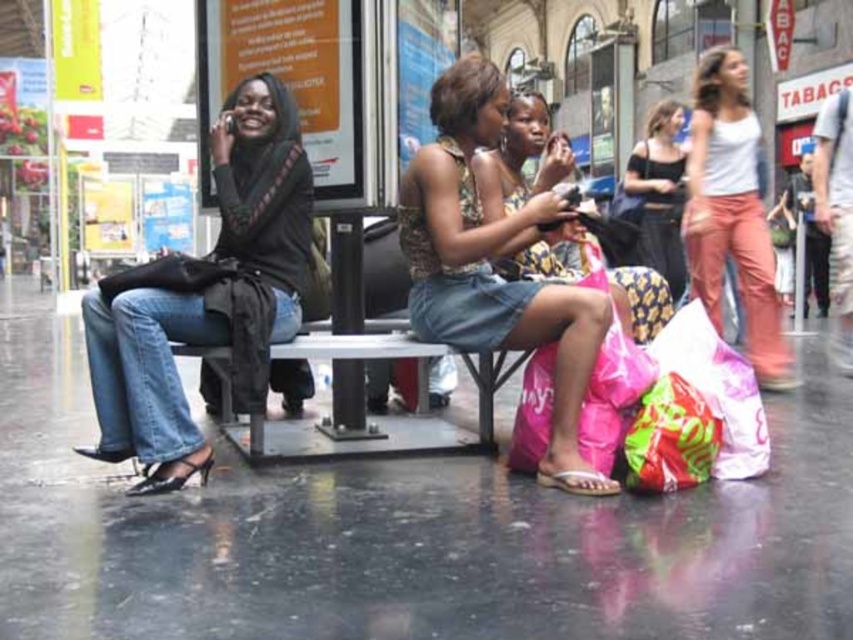
Does matte black jacket at left appear on the left side of white cotton tank top at upper right?

Yes, matte black jacket at left is to the left of white cotton tank top at upper right.

Does point (106, 436) come in front of point (750, 320)?

Yes, it is in front of point (750, 320).

Is point (169, 333) positioned in front of point (730, 58)?

Yes, it is.

Locate an element on the screen. matte black jacket at left is located at coordinates (206, 294).

Is point (469, 92) behind point (497, 216)?

No, it is not.

Is denim skirt at center behind patterned fabric dress at center?

No, denim skirt at center is closer to the viewer.

Is point (508, 97) closer to viewer compared to point (512, 198)?

Yes, point (508, 97) is closer to viewer.

Identify the location of denim skirt at center. The image size is (853, 640). (491, 266).

Can you confirm if matte black jacket at left is positioned below metallic gray bench at center?

No, matte black jacket at left is not below metallic gray bench at center.

Does matte black jacket at left appear on the right side of metallic gray bench at center?

No, matte black jacket at left is not to the right of metallic gray bench at center.

Does point (281, 280) lie behind point (343, 374)?

That is False.

In order to click on matte black jacket at left in this screenshot , I will do `click(206, 294)`.